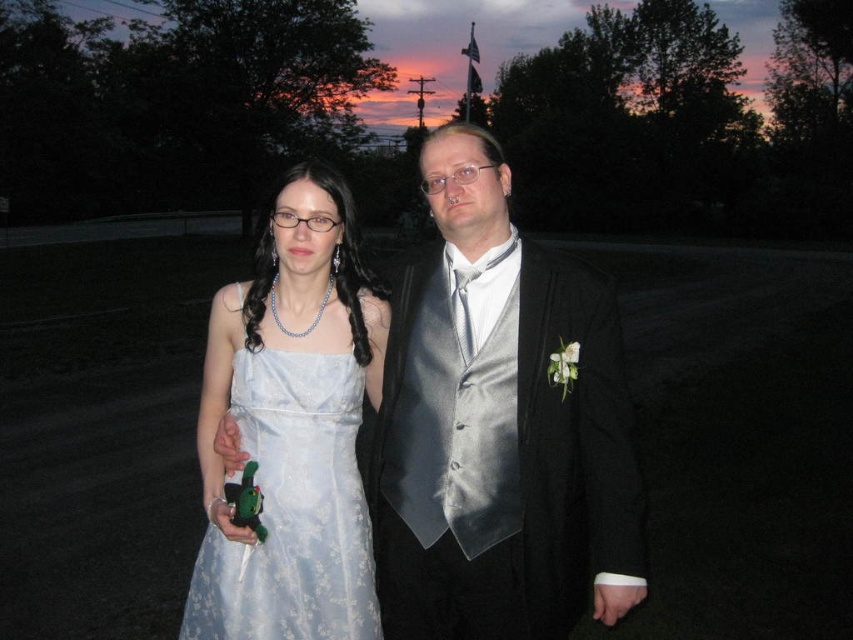
Question: Does satin dress at center have a greater width compared to satin dress at left?

Choices:
 (A) yes
 (B) no

Answer: (A)

Question: Is satin dress at center smaller than satin dress at left?

Choices:
 (A) yes
 (B) no

Answer: (B)

Question: Which of the following is the closest to the observer?

Choices:
 (A) click(x=419, y=346)
 (B) click(x=247, y=531)

Answer: (B)

Question: Is satin dress at center positioned in front of satin dress at left?

Choices:
 (A) no
 (B) yes

Answer: (B)